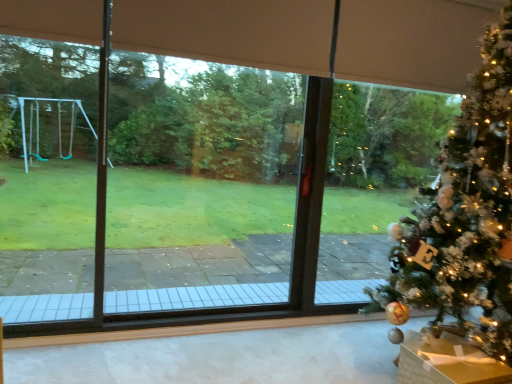
Question: From a real-world perspective, is white fluffy christmas tree at right physically located above or below metallic gold ornament at lower right?

Choices:
 (A) below
 (B) above

Answer: (B)

Question: Is white fluffy christmas tree at right in front of or behind metallic gold ornament at lower right in the image?

Choices:
 (A) front
 (B) behind

Answer: (A)

Question: In terms of width, does white fluffy christmas tree at right look wider or thinner when compared to metallic gold ornament at lower right?

Choices:
 (A) wide
 (B) thin

Answer: (A)

Question: In the image, is metallic gold ornament at lower right positioned in front of or behind white fluffy christmas tree at right?

Choices:
 (A) behind
 (B) front

Answer: (A)

Question: Is point (450, 370) positioned closer to the camera than point (408, 243)?

Choices:
 (A) closer
 (B) farther

Answer: (A)

Question: Would you say metallic gold ornament at lower right is inside or outside white fluffy christmas tree at right?

Choices:
 (A) inside
 (B) outside

Answer: (A)

Question: Considering the positions of metallic gold ornament at lower right and white fluffy christmas tree at right in the image, is metallic gold ornament at lower right bigger or smaller than white fluffy christmas tree at right?

Choices:
 (A) big
 (B) small

Answer: (B)